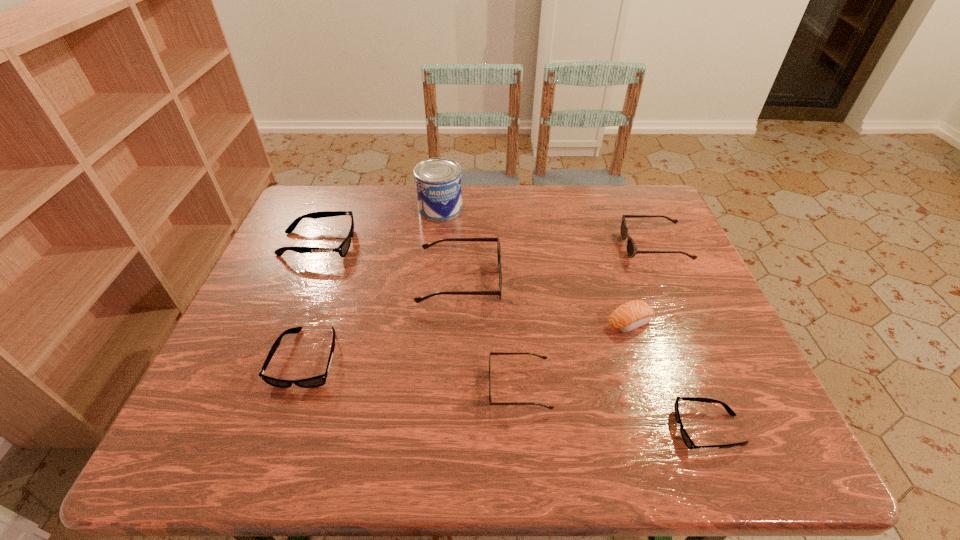
Choose which sunglasses is the fourth nearest neighbor to the biggest black sunglasses. Please provide its 2D coordinates. Your answer should be formatted as a tuple, i.e. [(x, y)], where the tuple contains the x and y coordinates of a point satisfying the conditions above.

[(632, 250)]

Locate which brown sunglasses ranks second in proximity to the can. Please provide its 2D coordinates. Your answer should be formatted as a tuple, i.e. [(x, y)], where the tuple contains the x and y coordinates of a point satisfying the conditions above.

[(632, 250)]

What are the coordinates of `brown sunglasses that is the second closest to the shortest object` in the screenshot? It's located at (418, 299).

The image size is (960, 540). In order to click on black sunglasses that is the second closest to the rightmost black sunglasses in this screenshot , I will do `click(344, 247)`.

Find the location of a particular element. This screenshot has width=960, height=540. the second closest black sunglasses to the rightmost brown sunglasses is located at coordinates (317, 381).

Where is `free space in the image that satisfies the following two spatial constraints: 1. on the front lenses of the seventh shortest object; 2. on the front-facing side of the second farthest black sunglasses`? This screenshot has width=960, height=540. free space in the image that satisfies the following two spatial constraints: 1. on the front lenses of the seventh shortest object; 2. on the front-facing side of the second farthest black sunglasses is located at coordinates tap(457, 359).

Identify the location of free spot that satisfies the following two spatial constraints: 1. on the front lenses of the second biggest brown sunglasses; 2. on the front side of the orange sushi. The width and height of the screenshot is (960, 540). [687, 322].

Where is `free space that satisfies the following two spatial constraints: 1. on the front label of the orange sushi; 2. on the right side of the tallest object`? This screenshot has width=960, height=540. free space that satisfies the following two spatial constraints: 1. on the front label of the orange sushi; 2. on the right side of the tallest object is located at coordinates (427, 322).